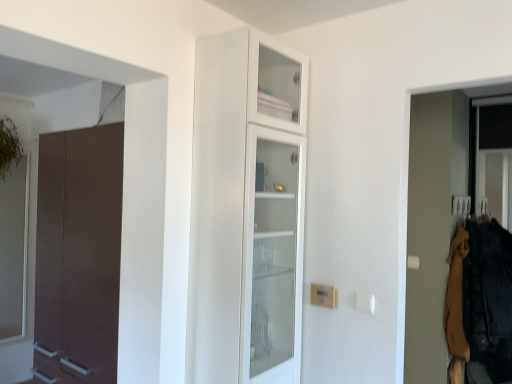
Question: Considering the positions of white glass cabinet at center and dark brown fabric at right, arranged as the 2th clothing when viewed from the left, in the image, is white glass cabinet at center taller or shorter than dark brown fabric at right, arranged as the 2th clothing when viewed from the left,?

Choices:
 (A) tall
 (B) short

Answer: (A)

Question: Considering the positions of white glass cabinet at center and dark brown fabric at right, arranged as the 2th clothing when viewed from the left, in the image, is white glass cabinet at center wider or thinner than dark brown fabric at right, arranged as the 2th clothing when viewed from the left,?

Choices:
 (A) thin
 (B) wide

Answer: (A)

Question: Which object is positioned closest to the dark brown fabric at right, marked as the 1th clothing in a right-to-left arrangement?

Choices:
 (A) brown woolen sweater at right, the second clothing viewed from the right
 (B) white glass cabinet at center

Answer: (A)

Question: Based on their relative distances, which object is nearer to the white glass cabinet at center?

Choices:
 (A) dark brown fabric at right, marked as the 1th clothing in a right-to-left arrangement
 (B) brown woolen sweater at right, the first clothing when ordered from left to right

Answer: (A)